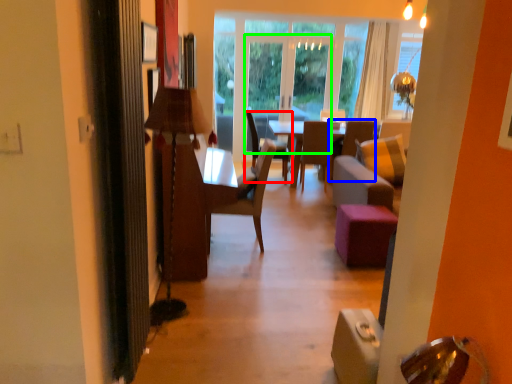
Question: Considering the real-world distances, which object is closest to chair (highlighted by a red box)? armchair (highlighted by a blue box) or glass door (highlighted by a green box).

Choices:
 (A) armchair
 (B) glass door

Answer: (B)